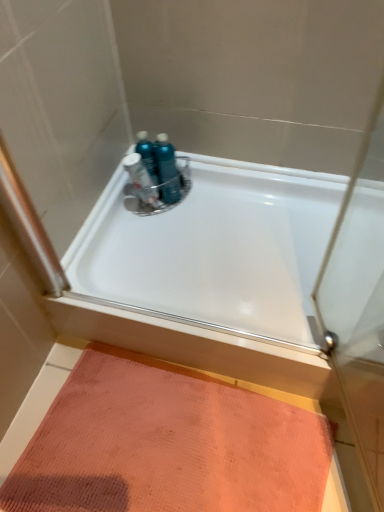
Identify the location of vacant area in front of translucent plastic bottles at center, positioned as the third toiletry in right-to-left order. pyautogui.click(x=149, y=237).